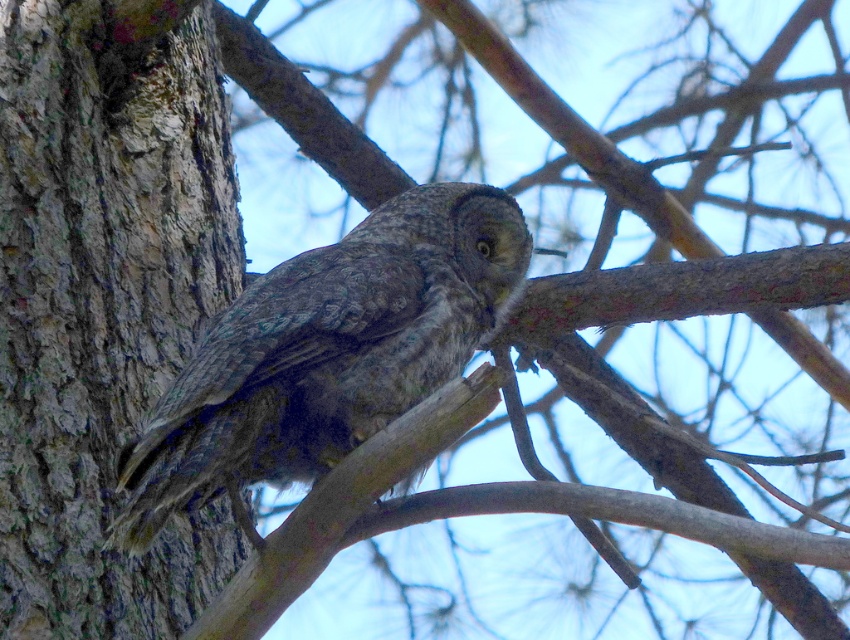
Question: Is rough bark tree trunk at left thinner than speckled gray owl at center?

Choices:
 (A) no
 (B) yes

Answer: (B)

Question: Which object is closer to the camera taking this photo?

Choices:
 (A) speckled gray owl at center
 (B) rough bark tree trunk at left

Answer: (A)

Question: Which of the following is the closest to the observer?

Choices:
 (A) rough bark tree trunk at left
 (B) speckled gray owl at center

Answer: (B)

Question: Is rough bark tree trunk at left wider than speckled gray owl at center?

Choices:
 (A) yes
 (B) no

Answer: (B)

Question: Among these objects, which one is nearest to the camera?

Choices:
 (A) rough bark tree trunk at left
 (B) speckled gray owl at center

Answer: (B)

Question: Can you confirm if rough bark tree trunk at left is thinner than speckled gray owl at center?

Choices:
 (A) yes
 (B) no

Answer: (A)